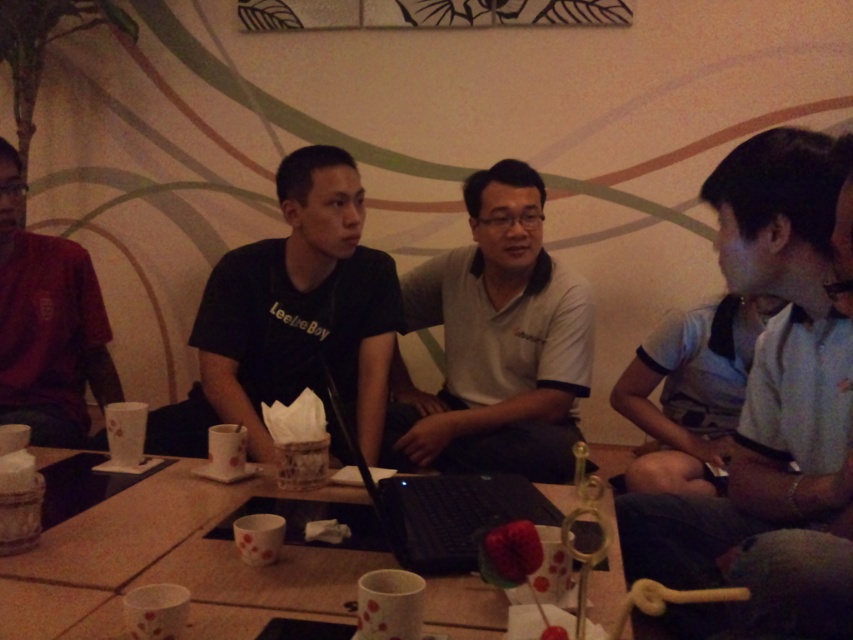
Can you confirm if white cotton shirt at right is wider than white matte shirt at center?

No.

Looking at this image, which is below, white cotton shirt at right or white matte shirt at center?

white cotton shirt at right is lower down.

Locate an element on the screen. The height and width of the screenshot is (640, 853). white cotton shirt at right is located at coordinates (773, 408).

Does black matte shirt at center appear under dark red shirt at left?

Correct, black matte shirt at center is located below dark red shirt at left.

Does point (358, 300) come behind point (33, 339)?

Yes, it is behind point (33, 339).

Is point (338, 244) positioned after point (62, 291)?

No, (338, 244) is closer to viewer.

Where is `black matte shirt at center`? The height and width of the screenshot is (640, 853). black matte shirt at center is located at coordinates (292, 316).

Is point (57, 321) closer to camera compared to point (451, 515)?

No, it is behind (451, 515).

Does dark red shirt at left come in front of black matte laptop at center?

No, dark red shirt at left is behind black matte laptop at center.

I want to click on dark red shirt at left, so click(47, 324).

You are a GUI agent. You are given a task and a screenshot of the screen. Output one action in this format:
    pyautogui.click(x=<x>, y=<y>)
    Task: Click on the dark red shirt at left
    Image resolution: width=853 pixels, height=640 pixels.
    Given the screenshot: What is the action you would take?
    pyautogui.click(x=47, y=324)